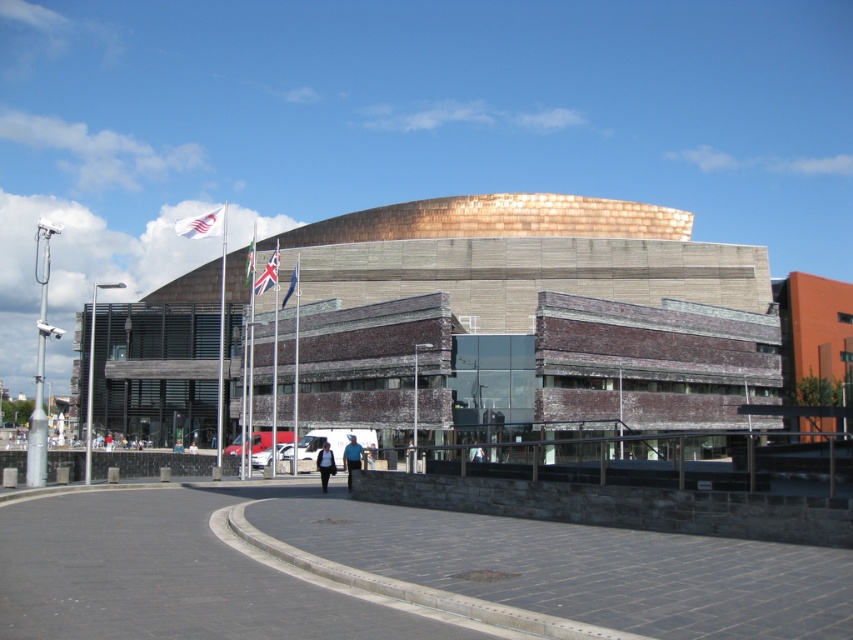
You are standing in front of the modern building with the curved roof and flags. There are two points marked on the ground in front of you. The first point is at coordinate point (209,232) and the second is at point (357,445). If you want to walk towards the building, which point will you step on first?

Point (209,232) is further to the camera than point (357,445), so you will step on point (209,232) first as it is closer to your current position when facing the building.

You are an architect visiting the building and notice the white fabric flag at upper left and the blue fabric jacket at center. Which object has a larger size?

The white fabric flag at upper left is bigger than the blue fabric jacket at center.